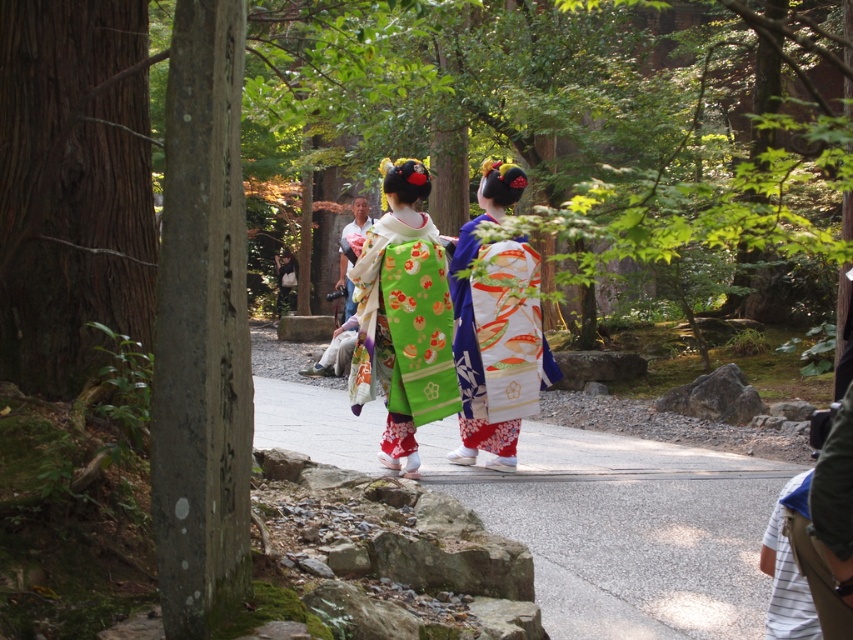
In the scene shown: You are standing at the entrance of the garden and see the smooth asphalt path at center and the white silk kimono at center. Which object is closer to you?

The smooth asphalt path at center is closer to you because it is located below the white silk kimono at center, indicating it is positioned lower in the visual plane and thus nearer to the observer.

You are a photographer positioned at the starting point of the pathway. You want to capture a photo where the green silk kimono at center is clearly visible in front of the white silk kimono at center. Based on the scene description, will this be possible?

Yes, because the green silk kimono at center is positioned in front of the white silk kimono at center, so it will naturally appear in front in the photo.